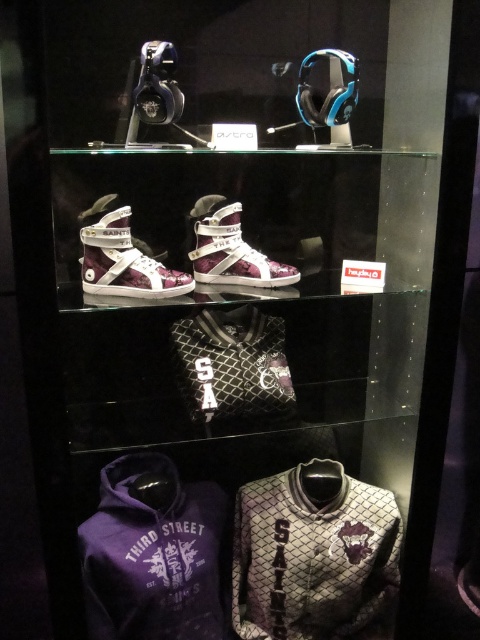
Question: Which point is farther to the camera?

Choices:
 (A) (225, 227)
 (B) (111, 566)
 (C) (352, 531)

Answer: (C)

Question: Is gray textured sweatshirt at center to the right of white leather high-top sneaker at center from the viewer's perspective?

Choices:
 (A) yes
 (B) no

Answer: (A)

Question: Does gray textured sweatshirt at center appear on the right side of purple fleece sweatshirt at lower left?

Choices:
 (A) yes
 (B) no

Answer: (A)

Question: Which point appears closest to the camera in this image?

Choices:
 (A) click(238, 241)
 (B) click(171, 522)

Answer: (B)

Question: Does matte purple fabric sneaker at center appear on the left side of white leather high-top sneaker at center?

Choices:
 (A) no
 (B) yes

Answer: (B)

Question: Which point is closer to the camera?

Choices:
 (A) white leather high-top sneaker at center
 (B) gray textured sweatshirt at center
 (C) purple fleece sweatshirt at lower left

Answer: (C)